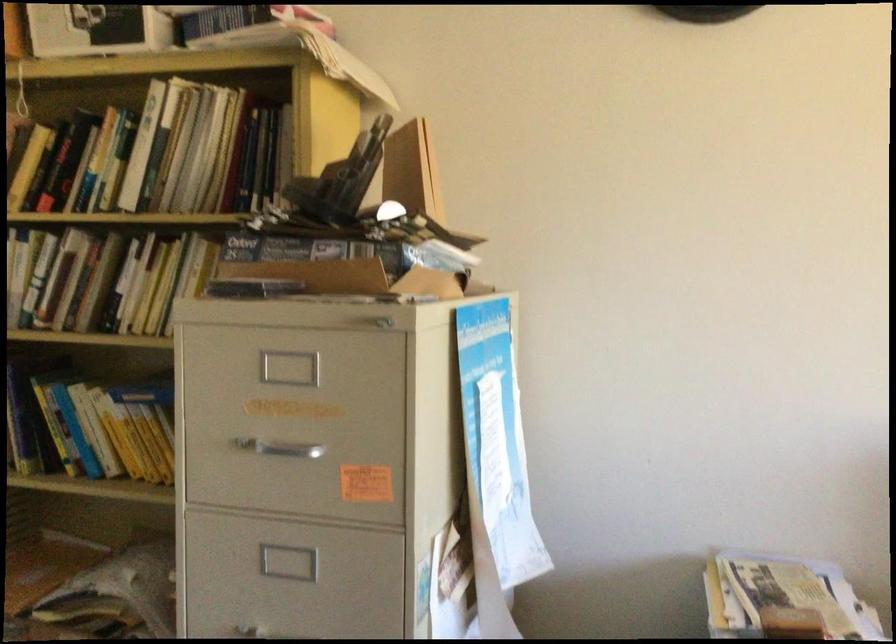
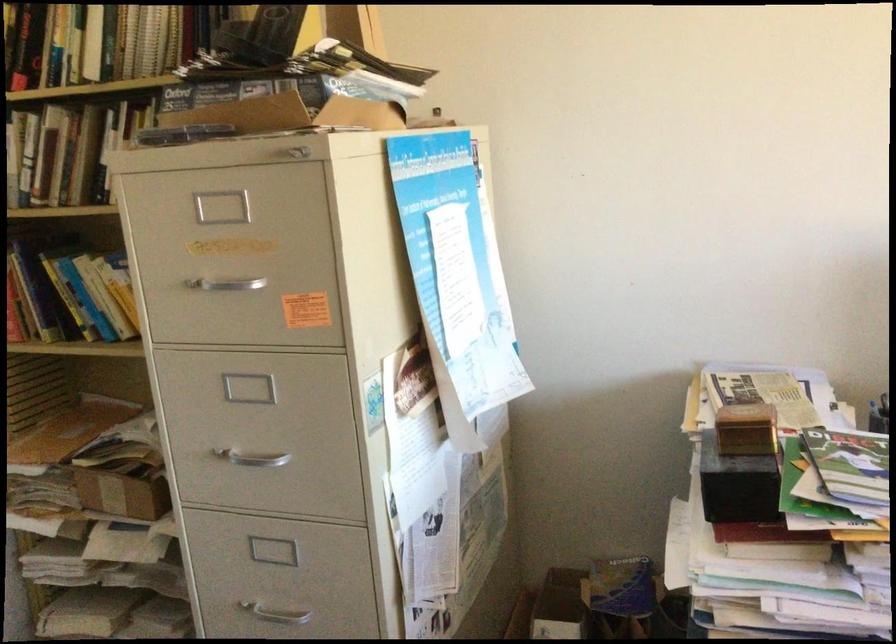
In the second image, find the point that corresponds to (106,176) in the first image.

(62, 46)